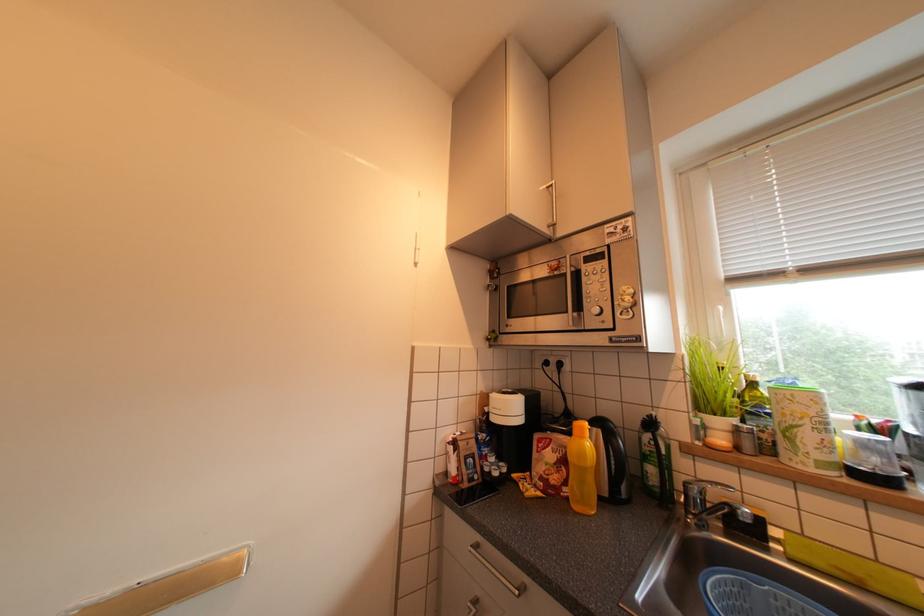
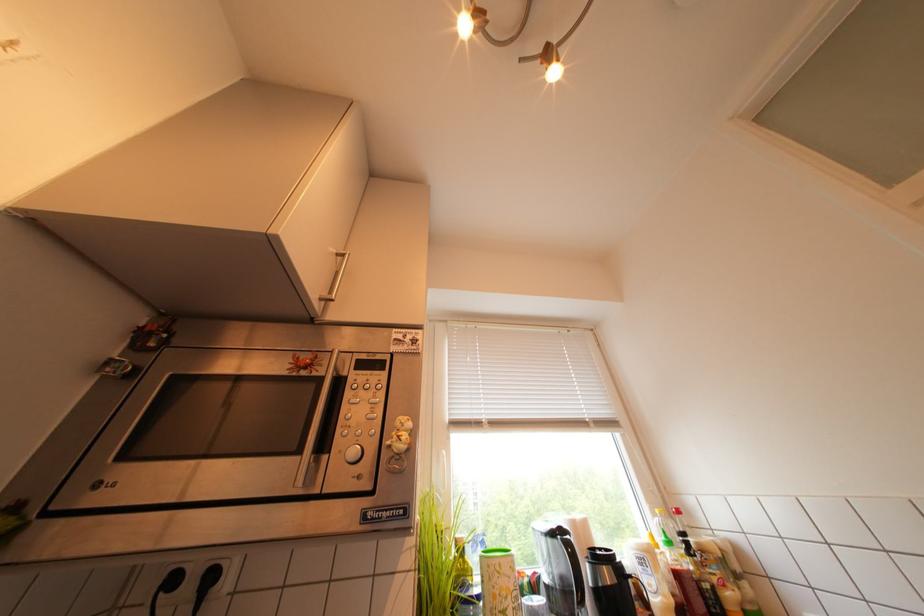
From the picture: The images are taken continuously from a first-person perspective. In which direction is your viewpoint rotating?

The rotation direction of the camera is right-up.